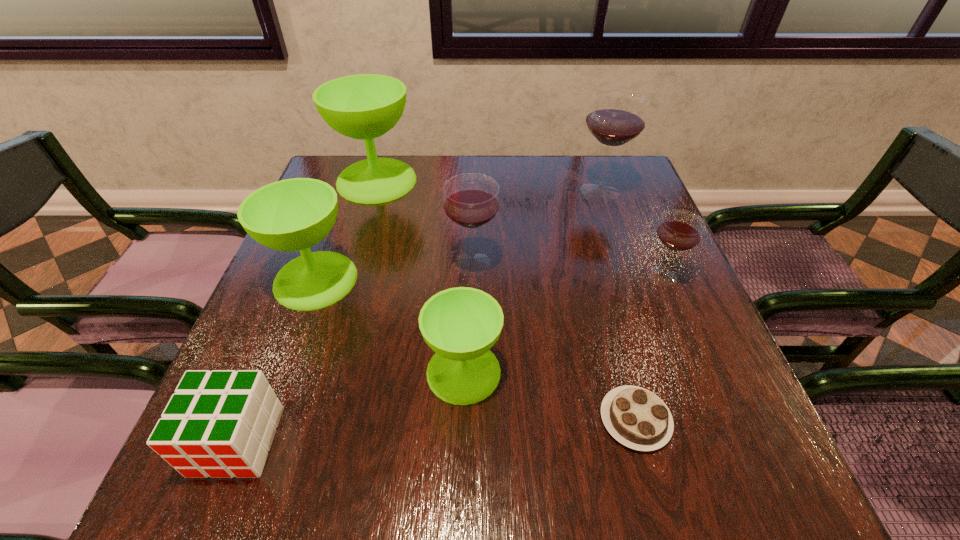
At what (x,y) coordinates should I click in order to perform the action: click on chocolate cake positioned at the right edge. Please return your answer as a coordinate pair (x, y). The image size is (960, 540). Looking at the image, I should click on (637, 418).

Locate an element on the screen. The width and height of the screenshot is (960, 540). object that is positioned at the far left corner is located at coordinates (365, 106).

Where is `object located in the near left corner section of the desktop`? The height and width of the screenshot is (540, 960). object located in the near left corner section of the desktop is located at coordinates click(221, 423).

I want to click on object at the far right corner, so click(x=616, y=117).

Where is `object located at the near right corner`? Image resolution: width=960 pixels, height=540 pixels. object located at the near right corner is located at coordinates (637, 418).

Locate an element on the screen. This screenshot has height=540, width=960. free space at the far edge of the desktop is located at coordinates (415, 172).

Locate an element on the screen. free space at the left edge is located at coordinates (241, 366).

Identify the location of vacant space at the right edge of the desktop. (660, 263).

Where is `free region at the far left corner`? This screenshot has width=960, height=540. free region at the far left corner is located at coordinates (348, 157).

Find the location of `vacant space at the far right corner of the desktop`. vacant space at the far right corner of the desktop is located at coordinates (612, 160).